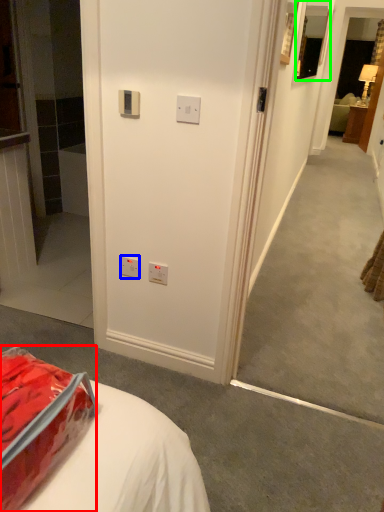
Question: Which object is positioned closest to package (highlighted by a red box)? Select from electric outlet (highlighted by a blue box) and picture frame (highlighted by a green box).

Choices:
 (A) electric outlet
 (B) picture frame

Answer: (A)